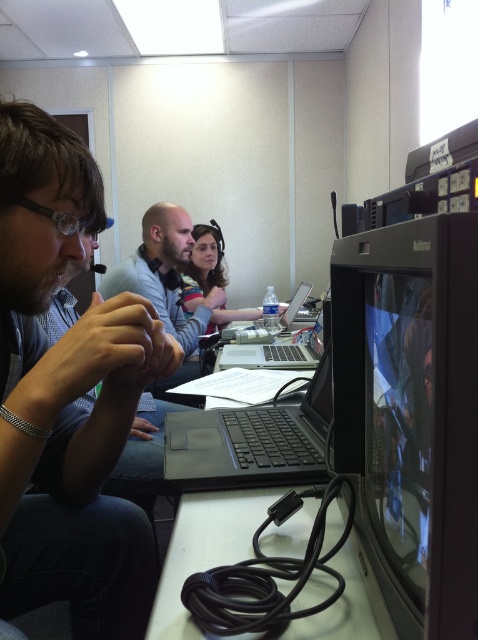
Question: Does black matte laptop at center have a greater width compared to satin black laptop at center?

Choices:
 (A) yes
 (B) no

Answer: (B)

Question: Which point appears farthest from the camera in this image?

Choices:
 (A) (424, 408)
 (B) (169, 225)

Answer: (B)

Question: Is black glossy monitor at right thinner than satin black laptop at center?

Choices:
 (A) yes
 (B) no

Answer: (A)

Question: Which object appears farthest from the camera in this image?

Choices:
 (A) black glossy monitor at right
 (B) matte black laptop at left

Answer: (B)

Question: Which object is the closest to the smooth gray shirt at center?

Choices:
 (A) black matte laptop at center
 (B) silver/black laptop at center

Answer: (B)

Question: Can you confirm if black glossy monitor at right is smaller than matte black monitor at right?

Choices:
 (A) yes
 (B) no

Answer: (B)